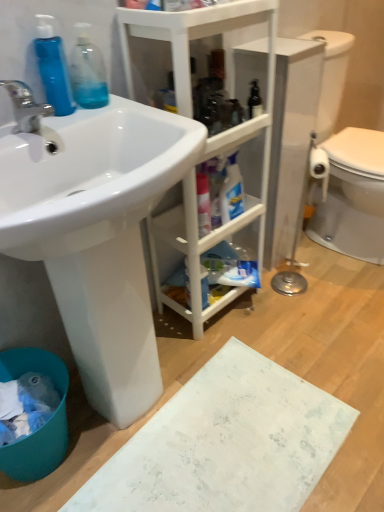
Locate an element on the screen. The width and height of the screenshot is (384, 512). free area in between blue plastic bottle at left, which appears as the second cleaning product when viewed from the right, and matte silver faucet at left is located at coordinates (52, 120).